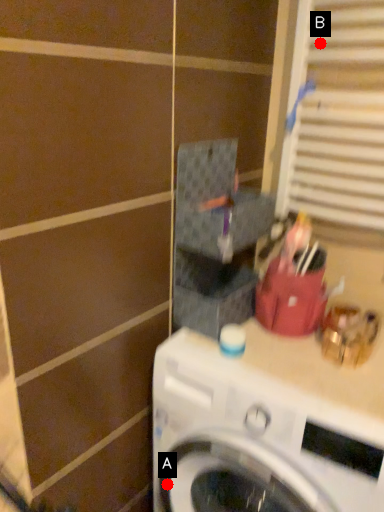
Question: Two points are circled on the image, labeled by A and B beside each circle. Which point is closer to the camera taking this photo?

Choices:
 (A) A is closer
 (B) B is closer

Answer: (A)